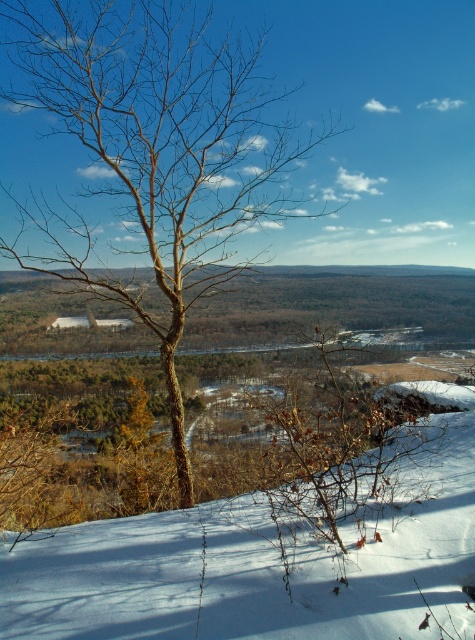
You are an observer standing at the top of the slope. You see a bare wood tree at center and white powdery snow at center. Which object is higher in elevation?

The bare wood tree at center is taller than the white powdery snow at center, so the bare wood tree at center is higher in elevation.

You are standing at the camera position looking at the winter landscape. You want to walk straight towards the bare wood tree at center. How far will you have to walk to reach it?

The distance between the bare wood tree at center and the camera is 18.45 feet, so you will have to walk 18.45 feet to reach it.